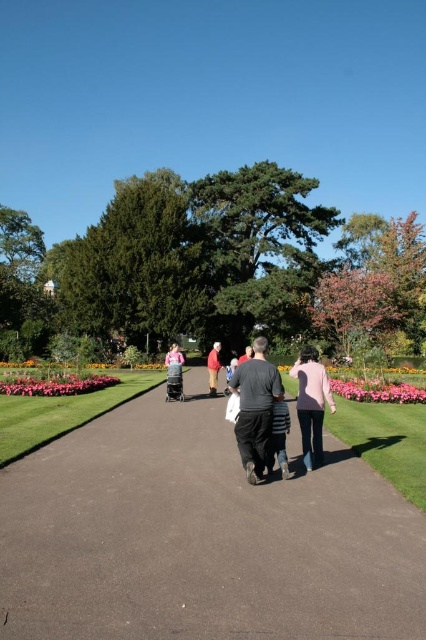
Question: Estimate the real-world distances between objects in this image. Which object is farther from the pink fabric at center?

Choices:
 (A) black asphalt path at center
 (B) pink floral bed at center

Answer: (A)

Question: Does pink fabric at center appear over dark gray sweater at center?

Choices:
 (A) no
 (B) yes

Answer: (A)

Question: Considering the real-world distances, which object is closest to the pink matte jacket at center?

Choices:
 (A) black asphalt path at center
 (B) pink floral bed at center

Answer: (A)

Question: Does black fabric stroller at center appear on the right side of pink fabric at center?

Choices:
 (A) no
 (B) yes

Answer: (B)

Question: Based on their relative distances, which object is nearer to the pink floral bed at center?

Choices:
 (A) pink fabric at center
 (B) dark gray fabric jacket at center
 (C) black fabric stroller at center
 (D) black asphalt path at center

Answer: (C)

Question: Can you confirm if black asphalt path at center is positioned to the right of pink fabric at center?

Choices:
 (A) yes
 (B) no

Answer: (A)